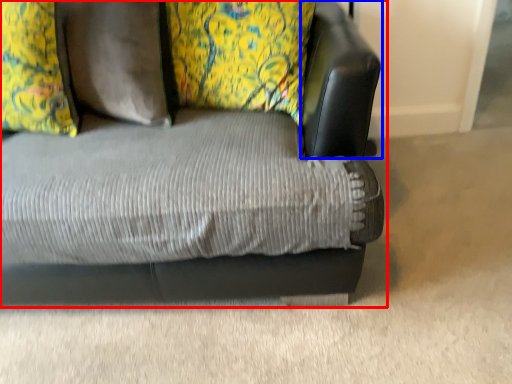
Question: Which object is further to the camera taking this photo, studio couch (highlighted by a red box) or swivel chair (highlighted by a blue box)?

Choices:
 (A) studio couch
 (B) swivel chair

Answer: (B)